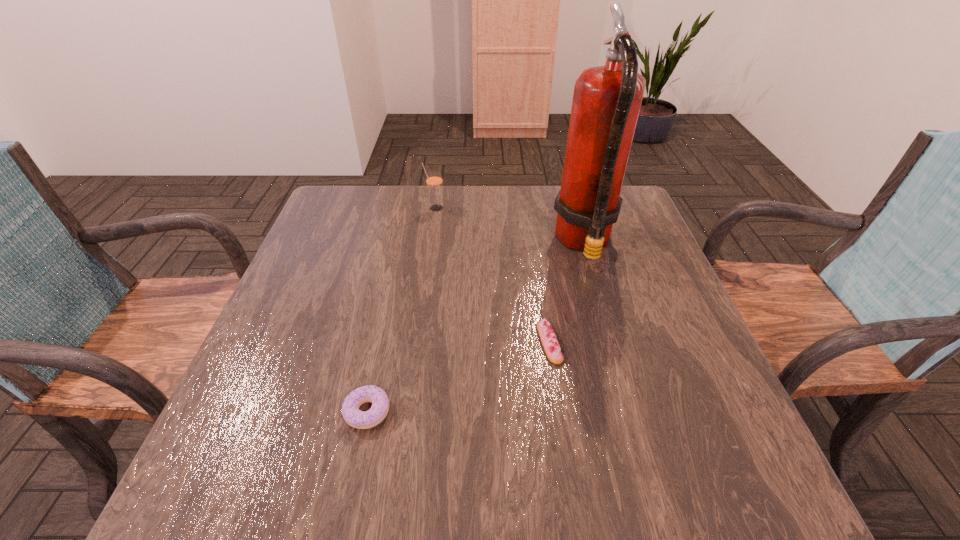
The height and width of the screenshot is (540, 960). I want to click on vacant space at the left edge, so 287,325.

At what (x,y) coordinates should I click in order to perform the action: click on free space at the right edge of the desktop. Please return your answer as a coordinate pair (x, y). The image size is (960, 540). Looking at the image, I should click on (677, 357).

Identify the location of free region at the far left corner. (349, 225).

Find the location of a particular element. The image size is (960, 540). vacant space in between the fire extinguisher and the second nearest object is located at coordinates (566, 293).

At what (x,y) coordinates should I click in order to perform the action: click on blank region between the third object from left to right and the farthest object. Please return your answer as a coordinate pair (x, y). This screenshot has width=960, height=540. Looking at the image, I should click on coord(492,275).

The height and width of the screenshot is (540, 960). Identify the location of empty space that is in between the farthest object and the fire extinguisher. (510, 225).

Find the location of a particular element. This screenshot has width=960, height=540. vacant region between the second object from left to right and the doughnut is located at coordinates (401, 310).

You are a GUI agent. You are given a task and a screenshot of the screen. Output one action in this format:
    pyautogui.click(x=<x>, y=<y>)
    Task: Click on the empty space that is in between the second object from left to right and the rightmost object
    
    Given the screenshot: What is the action you would take?
    pyautogui.click(x=510, y=225)

This screenshot has height=540, width=960. In order to click on free point between the doughnut and the straw in this screenshot , I will do `click(401, 310)`.

Identify the location of free spot between the third farthest object and the nearest object. (458, 377).